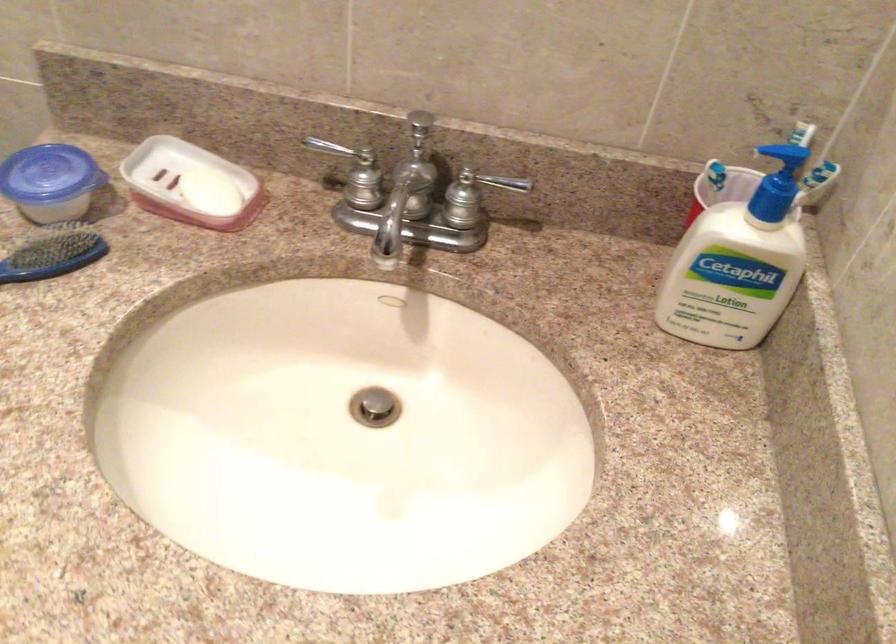
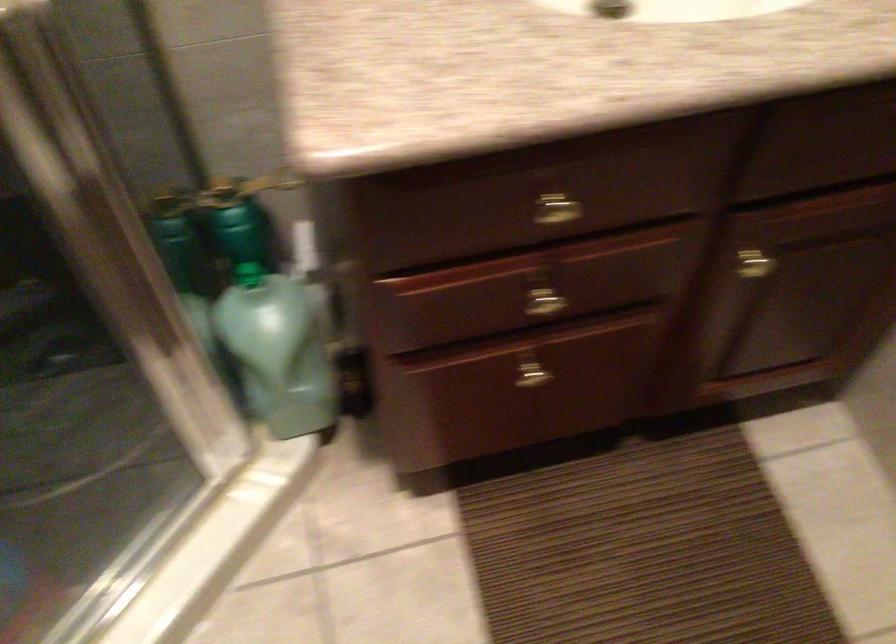
Question: The first image is from the beginning of the video and the second image is from the end. How did the camera likely rotate when shooting the video?

Choices:
 (A) Left
 (B) Right
 (C) Up
 (D) Down

Answer: (D)